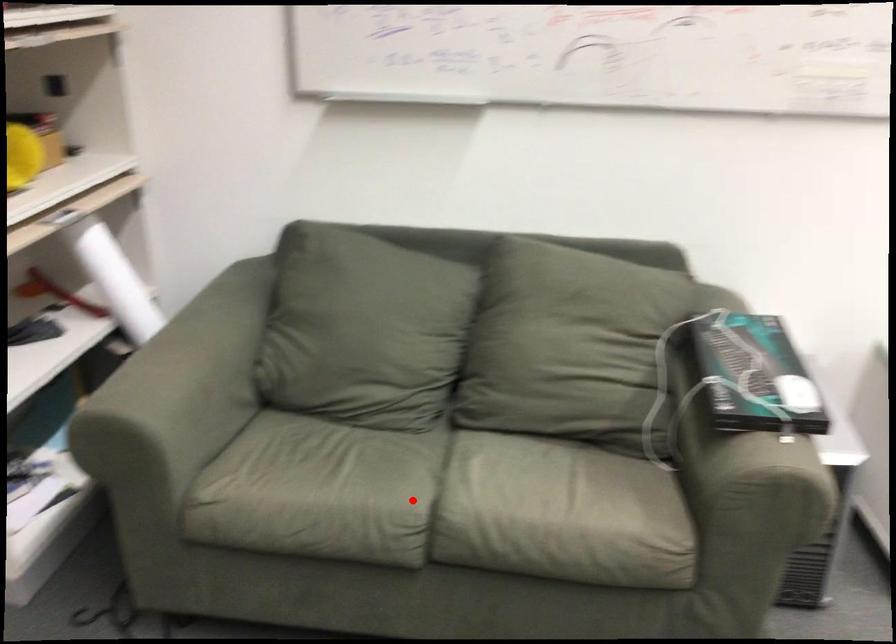
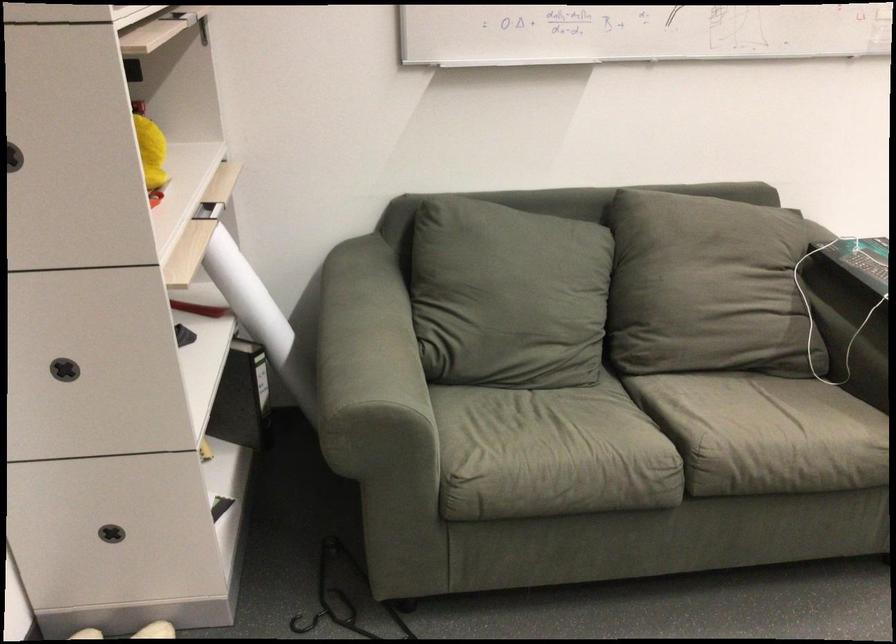
Locate, in the second image, the point that corresponds to the highlighted location in the first image.

(653, 444)